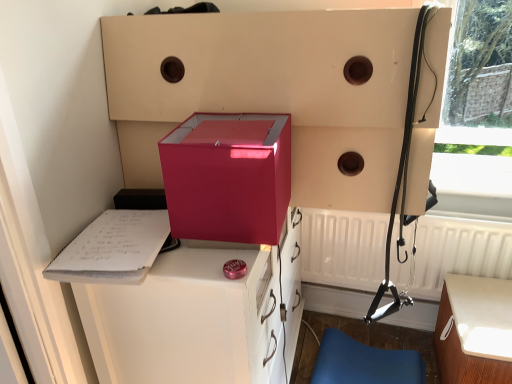
In order to click on free space above white wood table at lower right (from a real-world perspective) in this screenshot , I will do [x=481, y=310].